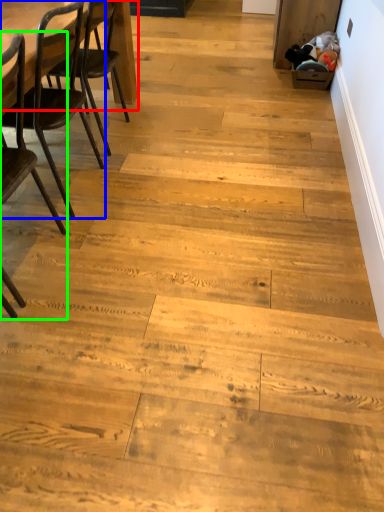
Question: Which object is the closest to the table (highlighted by a red box)? Choose among these: chair (highlighted by a blue box) or chair (highlighted by a green box).

Choices:
 (A) chair
 (B) chair

Answer: (A)